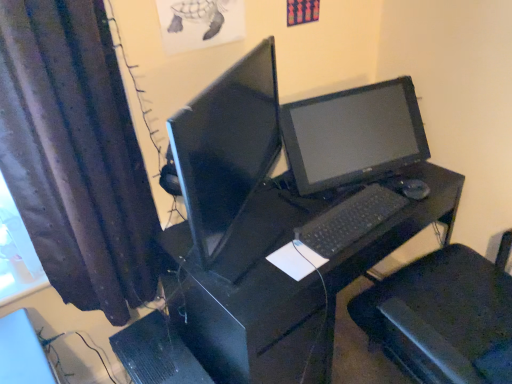
I want to click on free space above black matte keyboard at center (from a real-world perspective), so click(x=348, y=209).